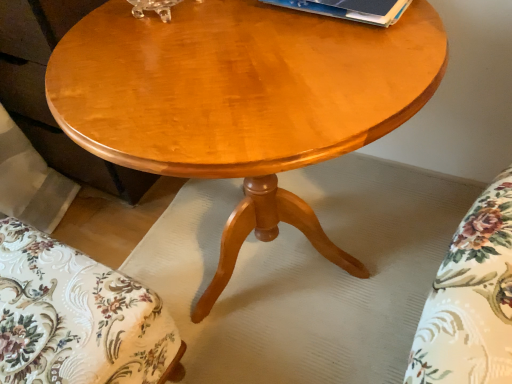
Locate an element on the screen. This screenshot has width=512, height=384. vacant space situated on the left part of blue paper at upper center is located at coordinates (228, 33).